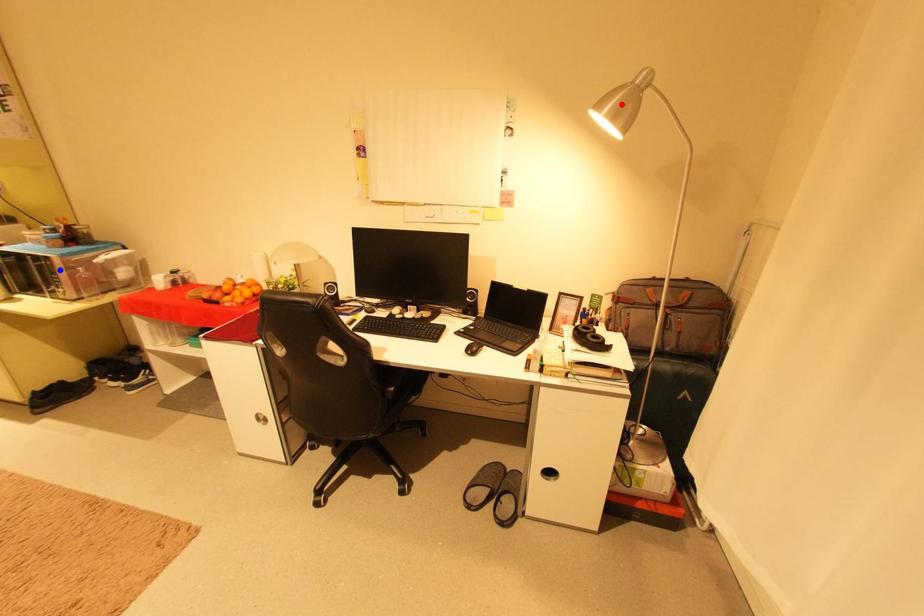
Question: In the image, two points are highlighted. Which point is nearer to the camera? Reply with the corresponding letter.

Choices:
 (A) blue point
 (B) red point

Answer: (B)